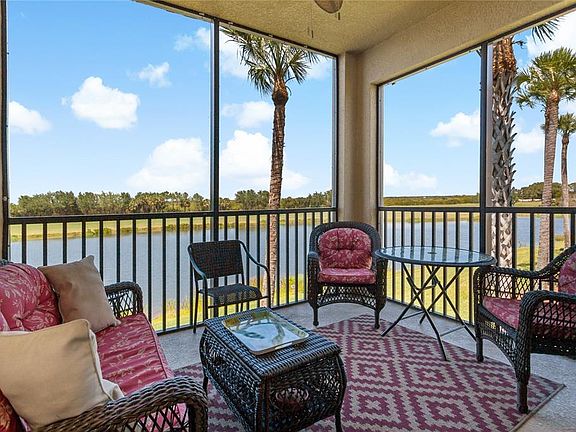
Image resolution: width=576 pixels, height=432 pixels. I want to click on pillow, so click(x=55, y=381), click(x=82, y=285).